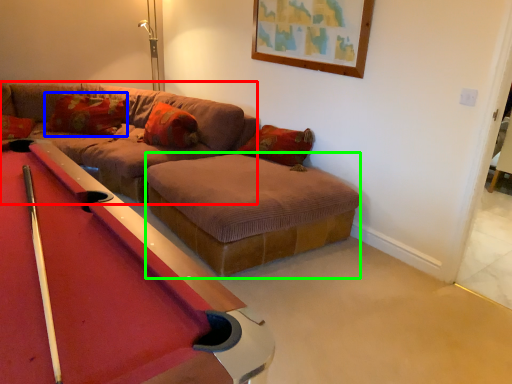
Question: Estimate the real-world distances between objects in this image. Which object is closer to couch (highlighted by a red box), pillow (highlighted by a blue box) or footrest (highlighted by a green box)?

Choices:
 (A) pillow
 (B) footrest

Answer: (A)